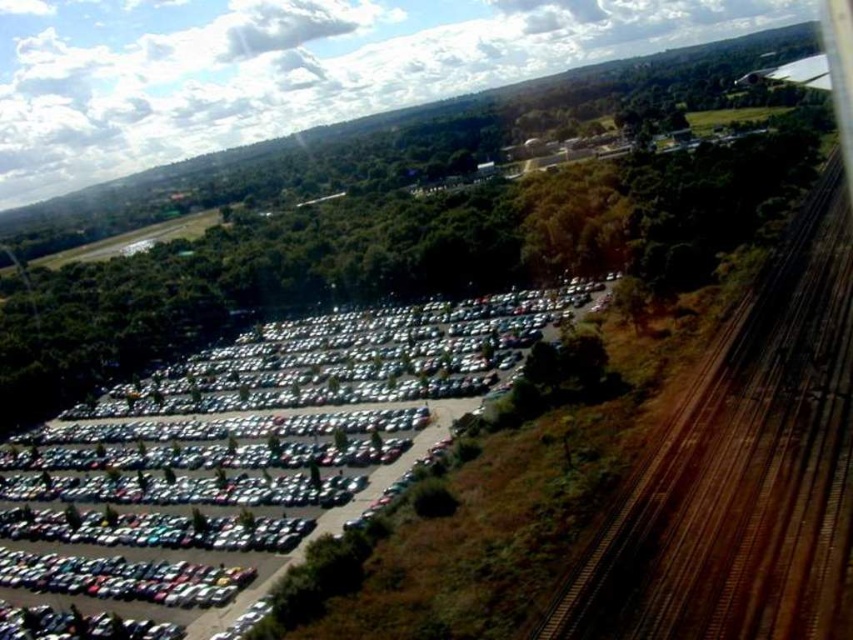
You are standing at the edge of the parking lot near the forest. You see the shiny metallic cars at center and the brown wooden train tracks at right. Which object is closer to the forest?

The shiny metallic cars at center are closer to the forest because they are positioned to the left of the brown wooden train tracks at right, which are further away from the forest bordering the parking lot.

You are a photographer trying to capture the entire scene of the parking lot and the railway tracks. Given that your camera frame can only accommodate objects up to the size of the shiny metallic cars at center, will the brown wooden train tracks at right fit within the frame?

The shiny metallic cars at center is bigger than brown wooden train tracks at right. Since the camera frame can accommodate the size of the shiny metallic cars at center, the brown wooden train tracks at right will definitely fit within the frame as they are smaller in size.

You are standing at the edge of the parking lot near the forest. You want to walk to a specific point marked at coordinates point (161,528). How far will you have to walk to reach that point?

The point (161,528) is 139.04 meters away from the viewer, so you will have to walk 139.04 meters to reach it.